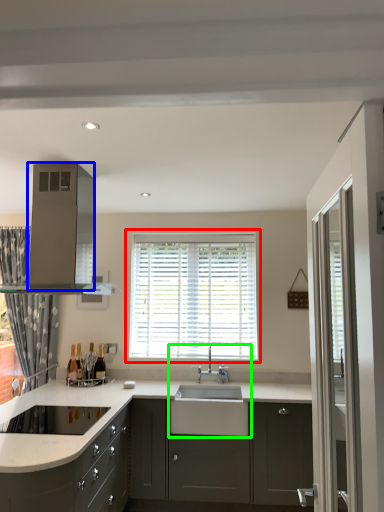
Question: Based on their relative distances, which object is nearer to window (highlighted by a red box)? Choose from appliance (highlighted by a blue box) and sink (highlighted by a green box).

Choices:
 (A) appliance
 (B) sink

Answer: (B)